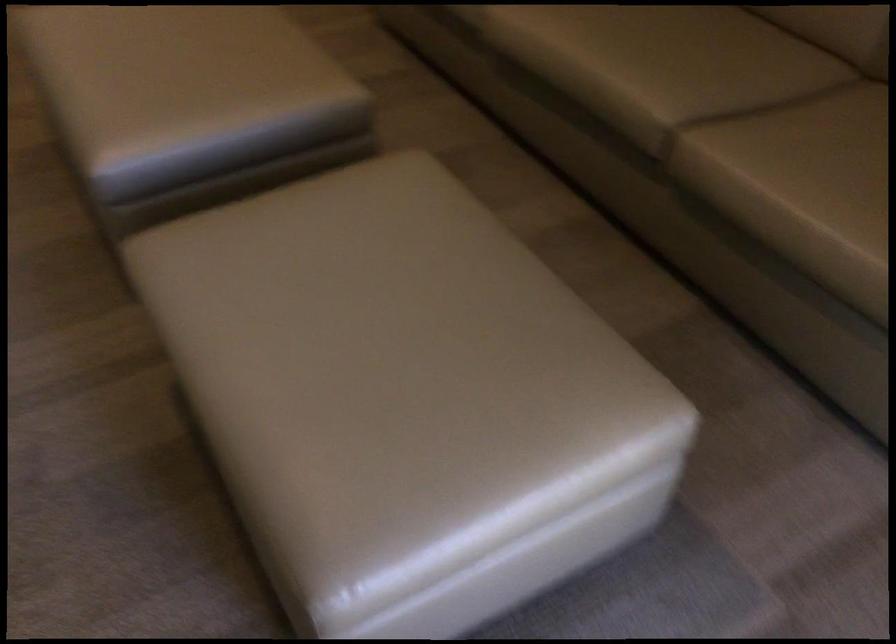
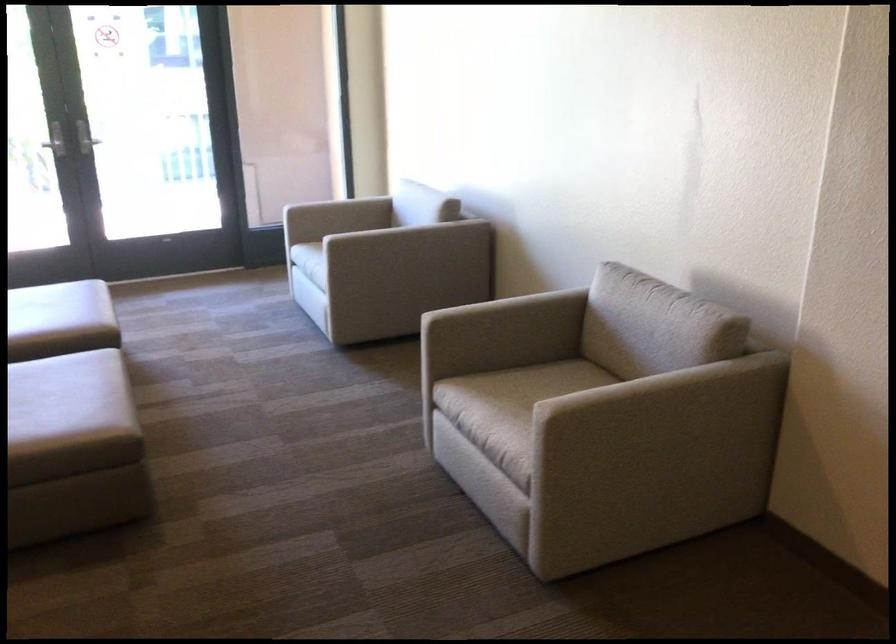
Locate, in the second image, the point that corresponds to [104,84] in the first image.

(65, 384)